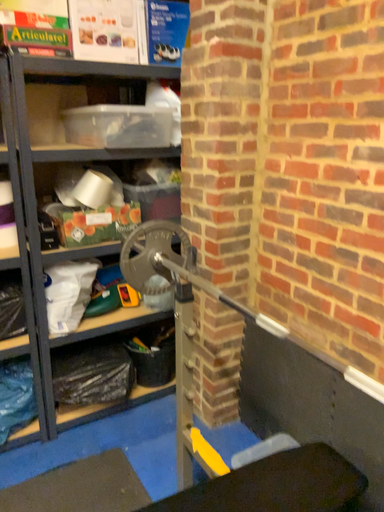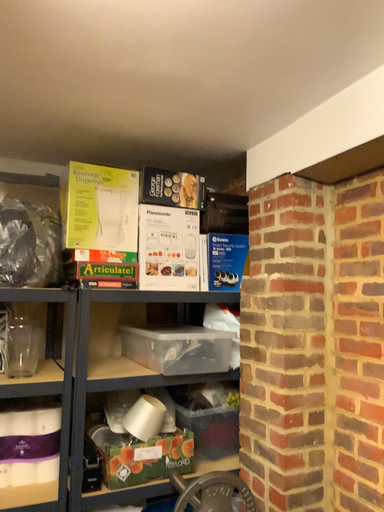
Question: How did the camera likely rotate when shooting the video?

Choices:
 (A) rotated upward
 (B) rotated downward

Answer: (A)